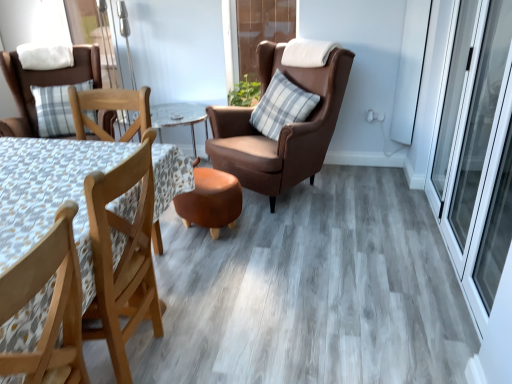
Question: Considering the positions of matte brown chair at left, the third chair when ordered from front to back, and wooden table at left in the image, is matte brown chair at left, the third chair when ordered from front to back, bigger or smaller than wooden table at left?

Choices:
 (A) small
 (B) big

Answer: (B)

Question: Relative to wooden table at left, is matte brown chair at left, the first chair from the left, in front or behind?

Choices:
 (A) front
 (B) behind

Answer: (B)

Question: Which of these objects is positioned farthest from the wooden table at left?

Choices:
 (A) white soft pillow at upper left, marked as the 1th pillow in a left-to-right arrangement
 (B) brown leather screen door at upper center, the 2th screen door positioned from the right
 (C) wooden chair at lower left, the second chair from the right
 (D) matte brown chair at left, the 3th chair from the right
 (E) brown leather chair at center, which is the 2th chair in front-to-back order

Answer: (B)

Question: Which of these objects is positioned farthest from the brown leather chair at center, which is the 2th chair in front-to-back order?

Choices:
 (A) wooden chair at lower left, the second chair from the right
 (B) brown leather screen door at upper center, which is the first screen door from left to right
 (C) transparent glass screen door at right, the first screen door from the front
 (D) white soft pillow at upper left, arranged as the 2th pillow when viewed from the right
 (E) wooden table at left

Answer: (A)